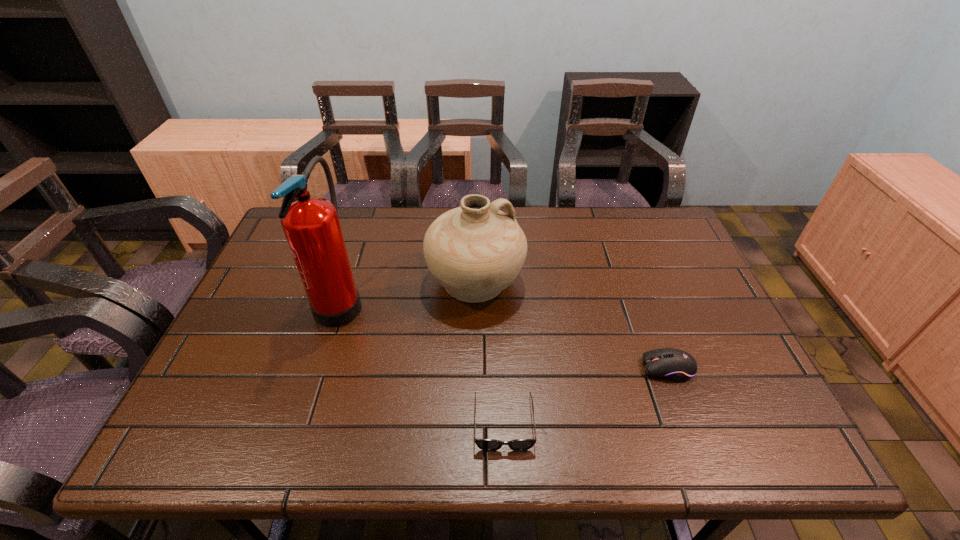
Select which object is the closest to the pottery. Please provide its 2D coordinates. Your answer should be formatted as a tuple, i.e. [(x, y)], where the tuple contains the x and y coordinates of a point satisfying the conditions above.

[(311, 225)]

I want to click on free location that satisfies the following two spatial constraints: 1. on the front side of the rightmost object; 2. on the right side of the leftmost object, so click(x=319, y=368).